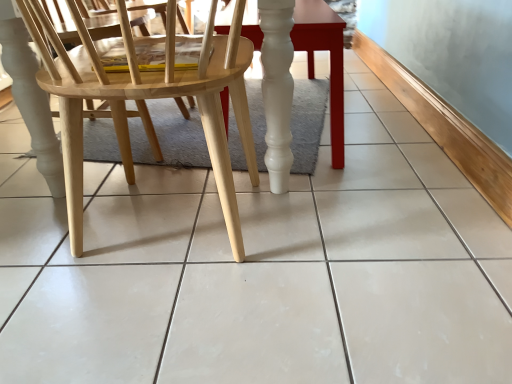
Locate an element on the screen. free space to the right of smooth glossy wood table at center is located at coordinates (372, 109).